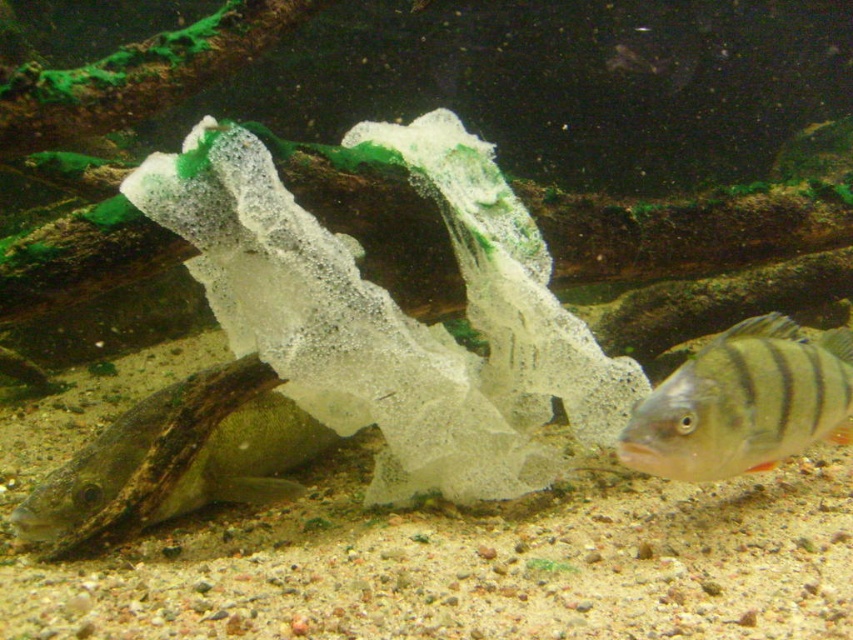
Question: Does smooth brown fish at lower left have a smaller size compared to shiny silver fish at lower right?

Choices:
 (A) no
 (B) yes

Answer: (A)

Question: Among these objects, which one is nearest to the camera?

Choices:
 (A) shiny silver fish at lower right
 (B) smooth brown fish at lower left

Answer: (A)

Question: Does smooth brown fish at lower left come behind shiny silver fish at lower right?

Choices:
 (A) no
 (B) yes

Answer: (B)

Question: Which point is closer to the camera?

Choices:
 (A) smooth brown fish at lower left
 (B) shiny silver fish at lower right

Answer: (B)

Question: Is smooth brown fish at lower left in front of shiny silver fish at lower right?

Choices:
 (A) no
 (B) yes

Answer: (A)